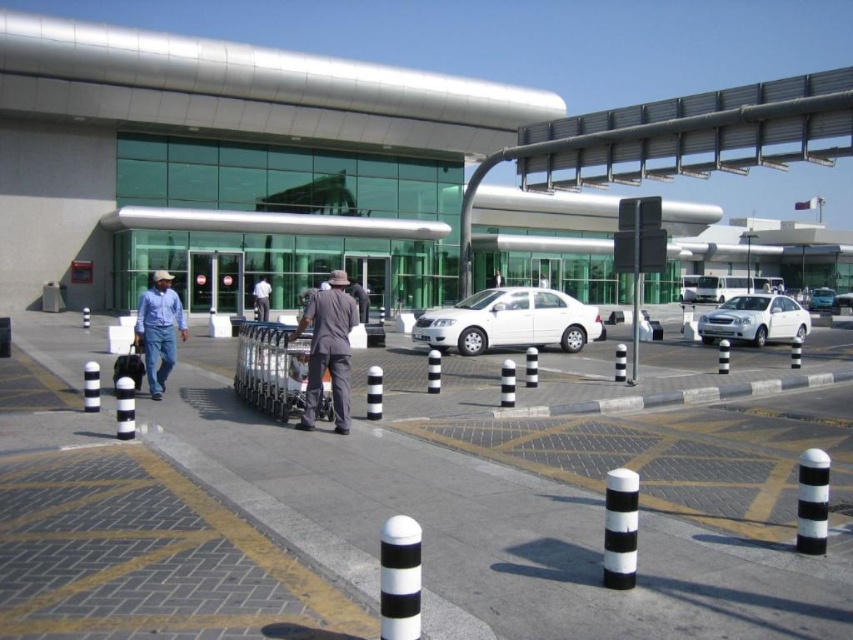
Which is more to the right, white fabric shirt at center or metallic silver sedan at center?

From the viewer's perspective, metallic silver sedan at center appears more on the right side.

Does white fabric shirt at center appear over metallic silver sedan at center?

Actually, white fabric shirt at center is below metallic silver sedan at center.

Is point (259, 314) less distant than point (820, 308)?

Yes, it is in front of point (820, 308).

The height and width of the screenshot is (640, 853). Identify the location of white fabric shirt at center. (260, 298).

Is dark gray fabric hat at center positioned in front of brown fabric shirt at center?

That is True.

Is dark gray fabric hat at center wider than brown fabric shirt at center?

Correct, the width of dark gray fabric hat at center exceeds that of brown fabric shirt at center.

Is point (317, 321) farther from viewer compared to point (494, 278)?

No, it is in front of (494, 278).

Find the location of a particular element. dark gray fabric hat at center is located at coordinates (328, 348).

Does metallic silver sedan at center have a greater width compared to brown fabric shirt at center?

Yes, metallic silver sedan at center is wider than brown fabric shirt at center.

Between point (814, 308) and point (502, 284), which one is positioned behind?

The point (814, 308) is behind.

Image resolution: width=853 pixels, height=640 pixels. I want to click on metallic silver sedan at center, so click(x=821, y=300).